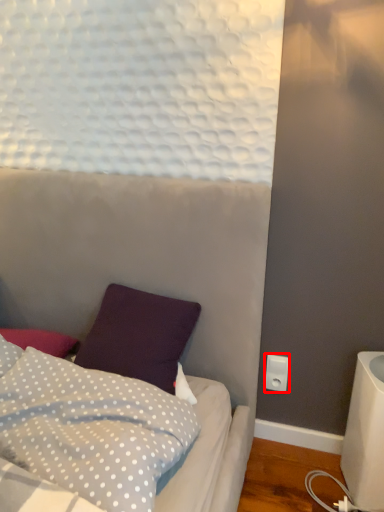
Question: Considering the relative positions of electric outlet (annotated by the red box) and pillow in the image provided, where is electric outlet (annotated by the red box) located with respect to the staircase?

Choices:
 (A) left
 (B) right

Answer: (B)